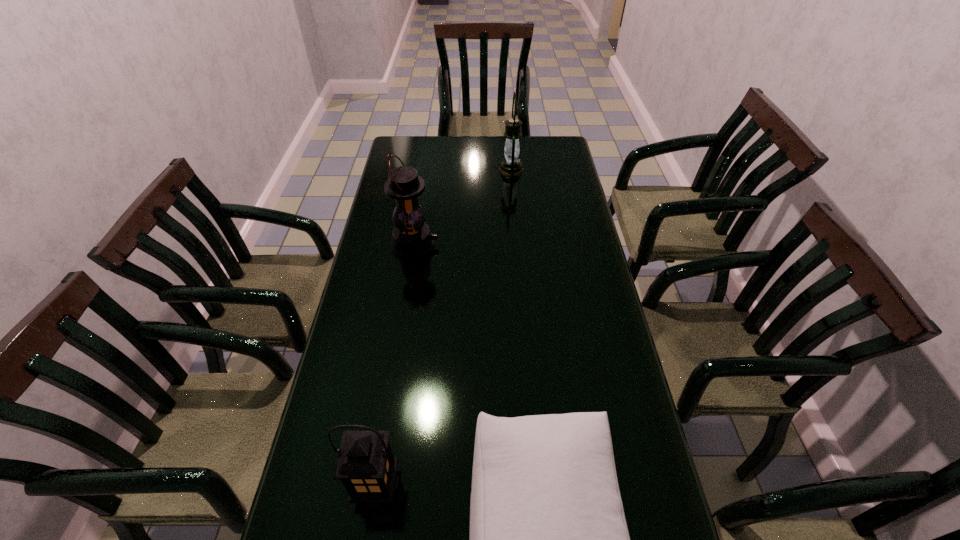
You are a GUI agent. You are given a task and a screenshot of the screen. Output one action in this format:
    pyautogui.click(x=<x>, y=<y>)
    Task: Click on the vacant area at the far edge of the desktop
    This screenshot has width=960, height=540.
    Given the screenshot: What is the action you would take?
    pyautogui.click(x=496, y=164)

You are a GUI agent. You are given a task and a screenshot of the screen. Output one action in this format:
    pyautogui.click(x=<x>, y=<y>)
    Task: Click on the free space at the left edge of the desktop
    The image size is (960, 540).
    Given the screenshot: What is the action you would take?
    pyautogui.click(x=356, y=398)

This screenshot has width=960, height=540. In order to click on free space at the right edge of the desktop in this screenshot , I will do `click(540, 211)`.

At what (x,y) coordinates should I click in order to perform the action: click on vacant space at the far right corner of the desktop. Please return your answer as a coordinate pair (x, y). Looking at the image, I should click on (548, 137).

What are the coordinates of `free space between the rightmost lantern and the second farthest lantern` in the screenshot? It's located at (463, 207).

Identify the location of free space that is in between the farthest lantern and the third nearest object. (463, 207).

Identify the location of free space between the farthest object and the second nearest lantern. This screenshot has width=960, height=540. coord(463,207).

Find the location of a particular element. Image resolution: width=960 pixels, height=540 pixels. free space between the rightmost lantern and the nearest lantern is located at coordinates (444, 328).

This screenshot has height=540, width=960. I want to click on vacant area that lies between the shortest lantern and the second farthest lantern, so click(396, 365).

Locate an element on the screen. The height and width of the screenshot is (540, 960). vacant area that lies between the shortest lantern and the second farthest object is located at coordinates (396, 365).